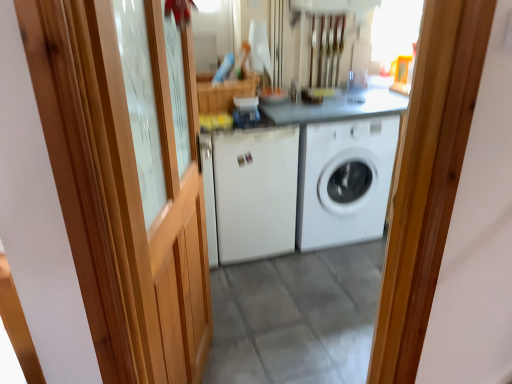
Question: Is wooden barn door at left thinner than white matte washing machine at center, the 2th washing machine from the right?

Choices:
 (A) no
 (B) yes

Answer: (B)

Question: Does wooden barn door at left have a greater height compared to white matte washing machine at center, which is the 1th washing machine in left-to-right order?

Choices:
 (A) no
 (B) yes

Answer: (B)

Question: Is white matte washing machine at center, which is the 1th washing machine in left-to-right order, completely or partially inside wooden barn door at left?

Choices:
 (A) no
 (B) yes

Answer: (A)

Question: Does wooden barn door at left have a greater width compared to white matte washing machine at center, the 2th washing machine from the right?

Choices:
 (A) no
 (B) yes

Answer: (A)

Question: From the image's perspective, is wooden barn door at left over white matte washing machine at center, the 2th washing machine from the right?

Choices:
 (A) yes
 (B) no

Answer: (B)

Question: Is point (99, 173) positioned closer to the camera than point (273, 140)?

Choices:
 (A) closer
 (B) farther

Answer: (A)

Question: Considering the positions of wooden barn door at left and white matte washing machine at center, the 2th washing machine from the right, in the image, is wooden barn door at left taller or shorter than white matte washing machine at center, the 2th washing machine from the right,?

Choices:
 (A) tall
 (B) short

Answer: (A)

Question: From the image's perspective, relative to white matte washing machine at center, the 2th washing machine from the right, is wooden barn door at left above or below?

Choices:
 (A) below
 (B) above

Answer: (A)

Question: Which is correct: wooden barn door at left is inside white matte washing machine at center, which is the 1th washing machine in left-to-right order, or outside of it?

Choices:
 (A) outside
 (B) inside

Answer: (A)

Question: In terms of width, does white matte washing machine at center, the first washing machine positioned from the right, look wider or thinner when compared to white matte washing machine at center, the 2th washing machine from the right?

Choices:
 (A) thin
 (B) wide

Answer: (B)

Question: Considering the positions of white matte washing machine at center, the first washing machine positioned from the right, and white matte washing machine at center, the 2th washing machine from the right, in the image, is white matte washing machine at center, the first washing machine positioned from the right, bigger or smaller than white matte washing machine at center, the 2th washing machine from the right,?

Choices:
 (A) big
 (B) small

Answer: (A)

Question: Does point click(345, 236) appear closer or farther from the camera than point click(268, 206)?

Choices:
 (A) farther
 (B) closer

Answer: (A)

Question: Considering their positions, is white matte washing machine at center, the first washing machine positioned from the right, located in front of or behind white matte washing machine at center, the 2th washing machine from the right?

Choices:
 (A) behind
 (B) front

Answer: (A)

Question: From the image's perspective, relative to wooden barn door at left, is white matte washing machine at center, arranged as the second washing machine when viewed from the left, above or below?

Choices:
 (A) below
 (B) above

Answer: (B)

Question: Looking at their shapes, would you say white matte washing machine at center, the first washing machine positioned from the right, is wider or thinner than wooden barn door at left?

Choices:
 (A) thin
 (B) wide

Answer: (B)